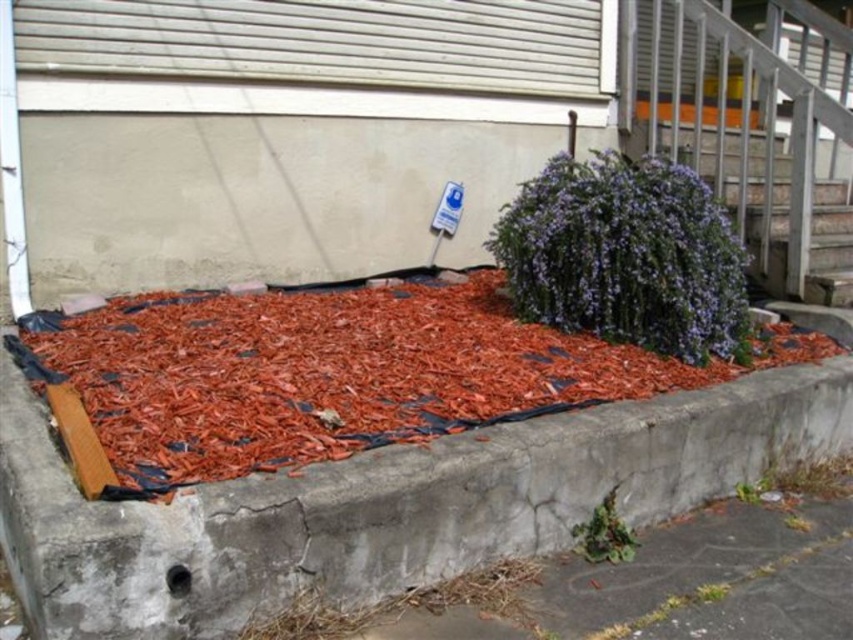
Measure the distance from purple matte bush at center to wooden at upper right.

The distance of purple matte bush at center from wooden at upper right is 1.45 meters.

Does purple matte bush at center have a lesser width compared to wooden at upper right?

Yes, purple matte bush at center is thinner than wooden at upper right.

Is point (537, 193) closer to viewer compared to point (722, 170)?

Yes, point (537, 193) is in front of point (722, 170).

What are the coordinates of `purple matte bush at center` in the screenshot? It's located at (625, 257).

Does red mulch at center have a greater width compared to green leafy plant at lower center?

Yes.

Is point (253, 300) closer to camera compared to point (612, 488)?

No, (253, 300) is further to viewer.

Who is more distant from viewer, (196,380) or (598,541)?

Positioned behind is point (196,380).

I want to click on red mulch at center, so click(331, 372).

Does red mulch at center have a larger size compared to purple matte bush at center?

Indeed, red mulch at center has a larger size compared to purple matte bush at center.

Does red mulch at center appear under purple matte bush at center?

Yes.

Is point (230, 321) farther from viewer compared to point (665, 173)?

No, (230, 321) is in front of (665, 173).

The width and height of the screenshot is (853, 640). I want to click on red mulch at center, so click(331, 372).